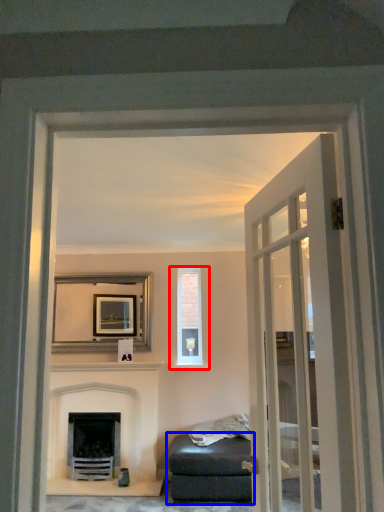
Question: Which object is closer to the camera taking this photo, window (highlighted by a red box) or studio couch (highlighted by a blue box)?

Choices:
 (A) window
 (B) studio couch

Answer: (B)